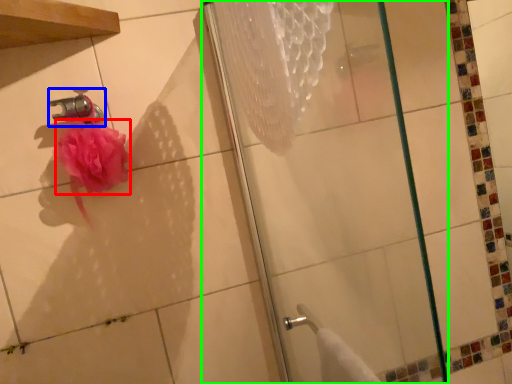
Question: Which object is positioned farthest from flower (highlighted by a red box)? Select from faucet (highlighted by a blue box) and shower (highlighted by a green box).

Choices:
 (A) faucet
 (B) shower

Answer: (B)